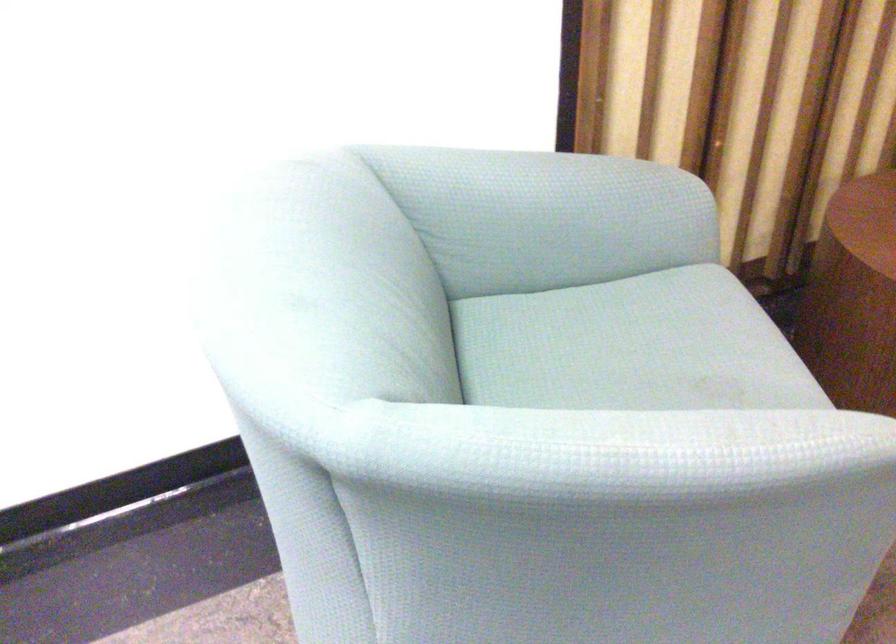
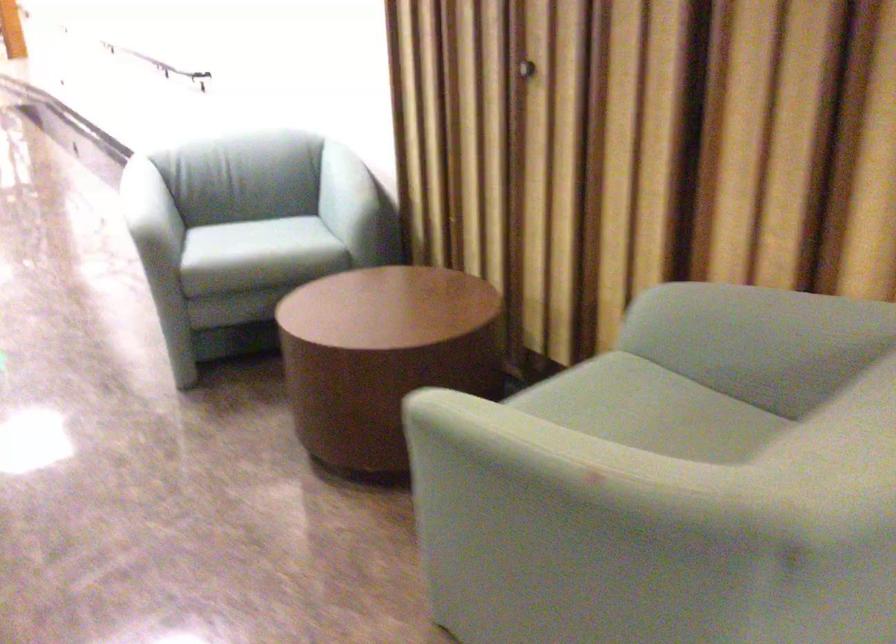
Locate, in the second image, the point that corresponds to point (712, 413) in the first image.

(147, 196)